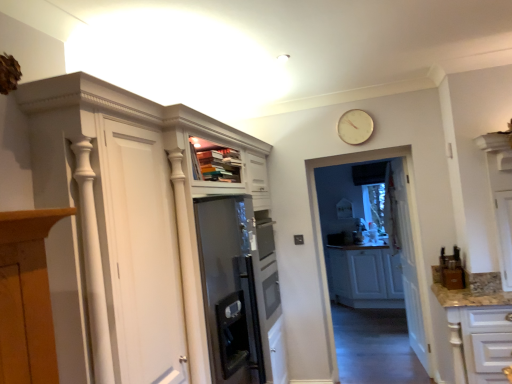
You are a GUI agent. You are given a task and a screenshot of the screen. Output one action in this format:
    pyautogui.click(x=<x>, y=<y>)
    Task: Click on the vacant region to the left of white wooden door at center
    Image resolution: width=512 pixels, height=384 pixels.
    Given the screenshot: What is the action you would take?
    pyautogui.click(x=388, y=359)